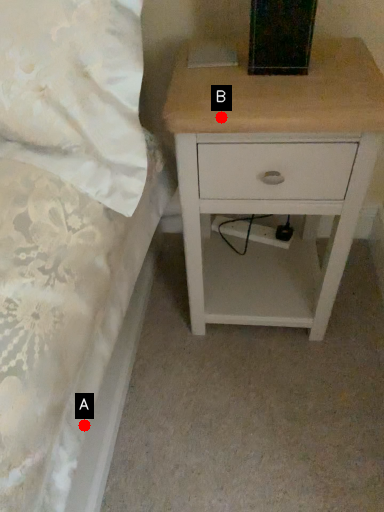
Question: Two points are circled on the image, labeled by A and B beside each circle. Which point is further to the camera?

Choices:
 (A) A is further
 (B) B is further

Answer: (B)